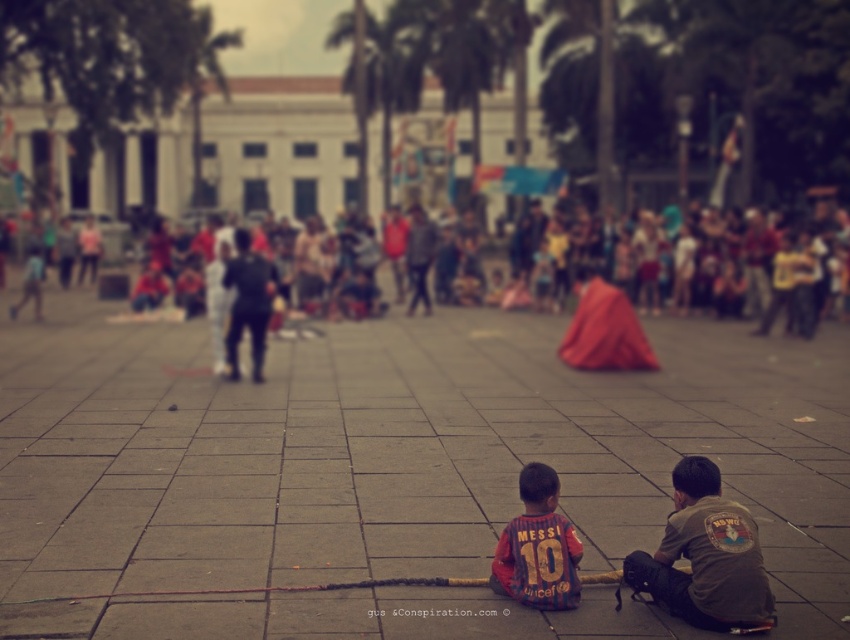
You are a photographer standing in the public square. You want to take a photo of the gray concrete pavement at center and the jersey at lower center. Which object is positioned higher in the image?

The gray concrete pavement at center is much taller than the jersey at lower center, so it is positioned higher in the image.

You are standing in the plaza and want to find the gray concrete pavement at center. According to the map, it is located at point [394,472]. Can you tell me where exactly that is?

The gray concrete pavement at center is located at point [394,472].